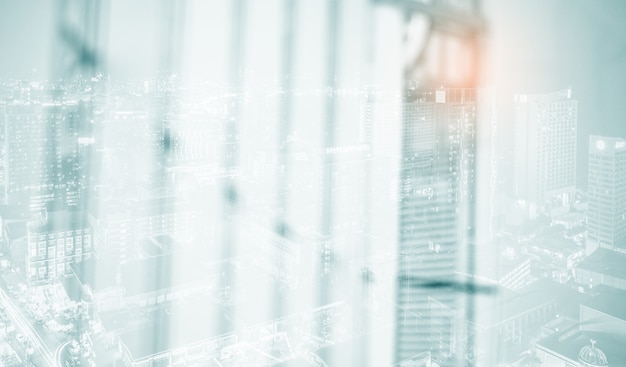
Locate an element on the screen. This screenshot has width=626, height=367. orange light is located at coordinates (454, 50).